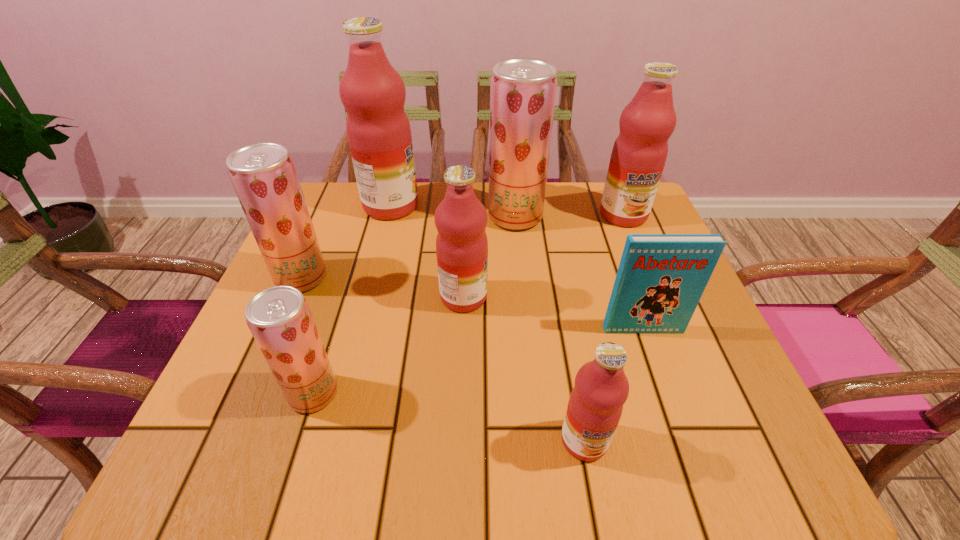
The width and height of the screenshot is (960, 540). I want to click on vacant region located 0.370m on the label of the fourth fruit juice from left to right, so click(660, 297).

Locate an element on the screen. This screenshot has height=540, width=960. vacant region located on the front cover of the blue book is located at coordinates (658, 372).

This screenshot has width=960, height=540. In order to click on vacant space located 0.390m on the back of the smallest strawberry fruit juice in this screenshot , I will do `click(362, 240)`.

The image size is (960, 540). I want to click on object positioned at the near edge, so click(601, 388).

I want to click on fruit juice located in the right edge section of the desktop, so click(x=639, y=153).

You are a GUI agent. You are given a task and a screenshot of the screen. Output one action in this format:
    pyautogui.click(x=<x>, y=<y>)
    Task: Click on the book that is at the right edge
    This screenshot has height=540, width=960.
    Given the screenshot: What is the action you would take?
    pyautogui.click(x=661, y=278)

Locate an element on the screen. This screenshot has width=960, height=540. object that is at the far left corner is located at coordinates (373, 93).

Image resolution: width=960 pixels, height=540 pixels. I want to click on object that is at the far right corner, so click(x=639, y=153).

The width and height of the screenshot is (960, 540). Find the location of `vacant area at the near edge of the desktop`. vacant area at the near edge of the desktop is located at coordinates (323, 453).

Identify the location of vacant space at the left edge of the desktop. This screenshot has width=960, height=540. (332, 290).